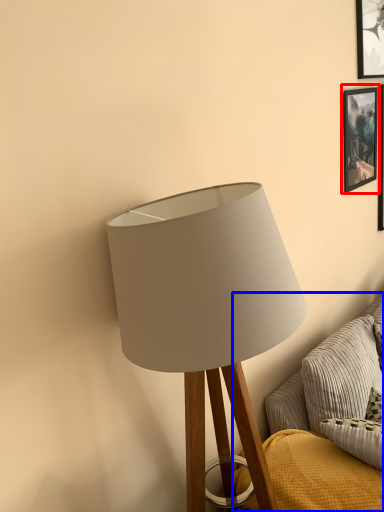
Question: Which of the following is the closest to the observer, picture frame (highlighted by a red box) or couch (highlighted by a blue box)?

Choices:
 (A) picture frame
 (B) couch

Answer: (B)